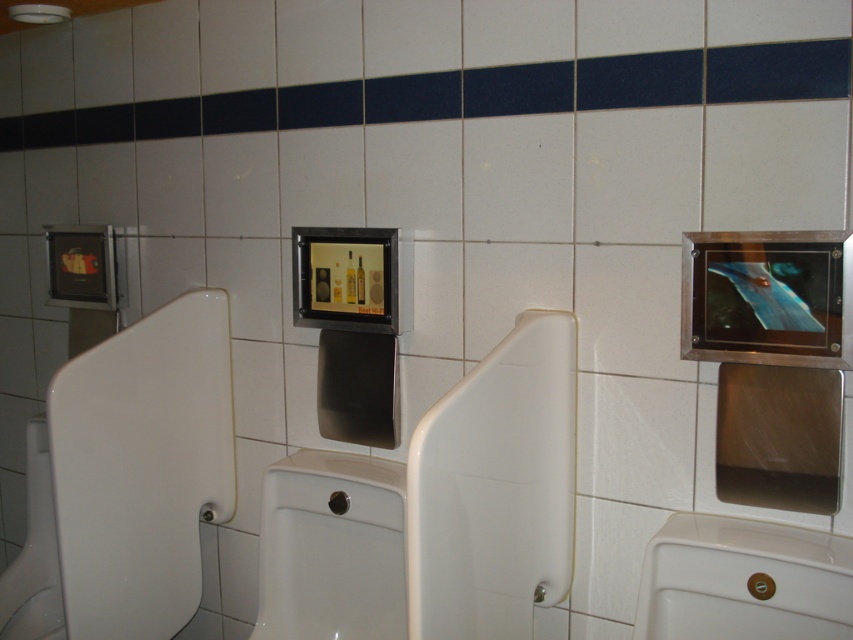
Can you confirm if white glossy urinal at left is positioned below white glossy urinal at center?

Indeed, white glossy urinal at left is positioned under white glossy urinal at center.

Who is positioned more to the left, white glossy urinal at left or white glossy urinal at center?

From the viewer's perspective, white glossy urinal at left appears more on the left side.

What do you see at coordinates (141, 467) in the screenshot? The image size is (853, 640). I see `white glossy urinal at left` at bounding box center [141, 467].

Image resolution: width=853 pixels, height=640 pixels. Find the location of `white glossy urinal at left`. white glossy urinal at left is located at coordinates (141, 467).

Based on the photo, does white glossy toilet bowl at center have a greater height compared to white glossy urinal at lower right?

Indeed, white glossy toilet bowl at center has a greater height compared to white glossy urinal at lower right.

Is white glossy toilet bowl at center positioned at the back of white glossy urinal at lower right?

That is True.

Is point (352, 496) closer to camera compared to point (691, 618)?

No, it is not.

You are a GUI agent. You are given a task and a screenshot of the screen. Output one action in this format:
    pyautogui.click(x=<x>, y=<y>)
    Task: Click on the white glossy toilet bowl at center
    The width and height of the screenshot is (853, 640).
    Given the screenshot: What is the action you would take?
    pyautogui.click(x=331, y=547)

Which of these two, white glossy urinal at left or white glossy urinal at lower right, stands shorter?

Standing shorter between the two is white glossy urinal at lower right.

Is point (196, 353) more distant than point (838, 577)?

That is True.

The image size is (853, 640). I want to click on white glossy urinal at left, so click(141, 467).

This screenshot has width=853, height=640. Find the location of `white glossy urinal at left`. white glossy urinal at left is located at coordinates (141, 467).